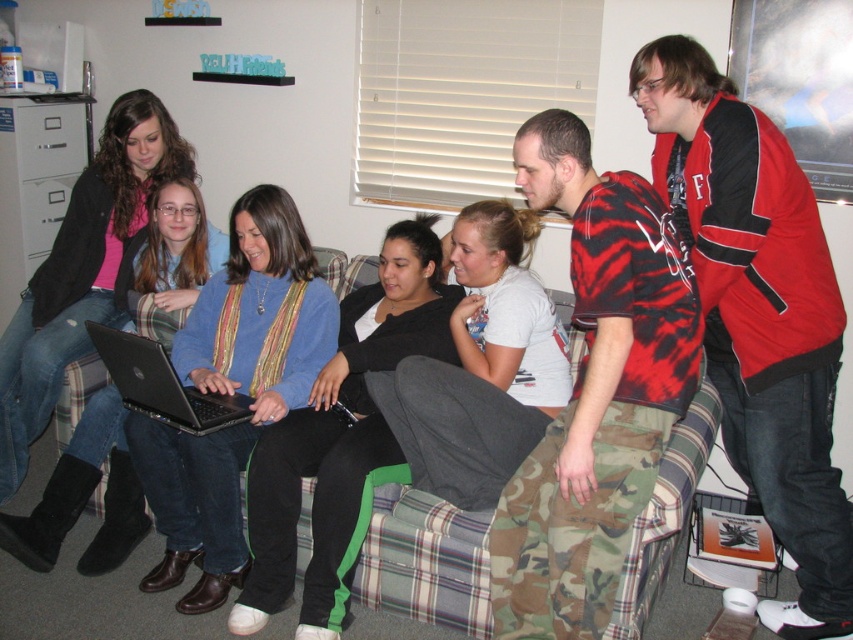
Is red jacket at upper right wider than black matte laptop at center?

Yes.

Does point (833, 284) lie behind point (96, 324)?

That is False.

This screenshot has height=640, width=853. Find the location of `red jacket at upper right`. red jacket at upper right is located at coordinates (758, 314).

Who is shorter, red tiger-striped shirt at center or black matte laptop at center?

black matte laptop at center is shorter.

Is point (541, 573) positioned after point (193, 413)?

No.

Locate an element on the screen. Image resolution: width=853 pixels, height=640 pixels. red tiger-striped shirt at center is located at coordinates (595, 392).

Is red jacket at upper right bigger than red tiger-striped shirt at center?

Yes, red jacket at upper right is bigger than red tiger-striped shirt at center.

Is red jacket at upper right thinner than red tiger-striped shirt at center?

No.

Who is more distant from viewer, [741,243] or [555,417]?

The point [555,417] is more distant.

This screenshot has width=853, height=640. Find the location of `red jacket at upper right`. red jacket at upper right is located at coordinates (758, 314).